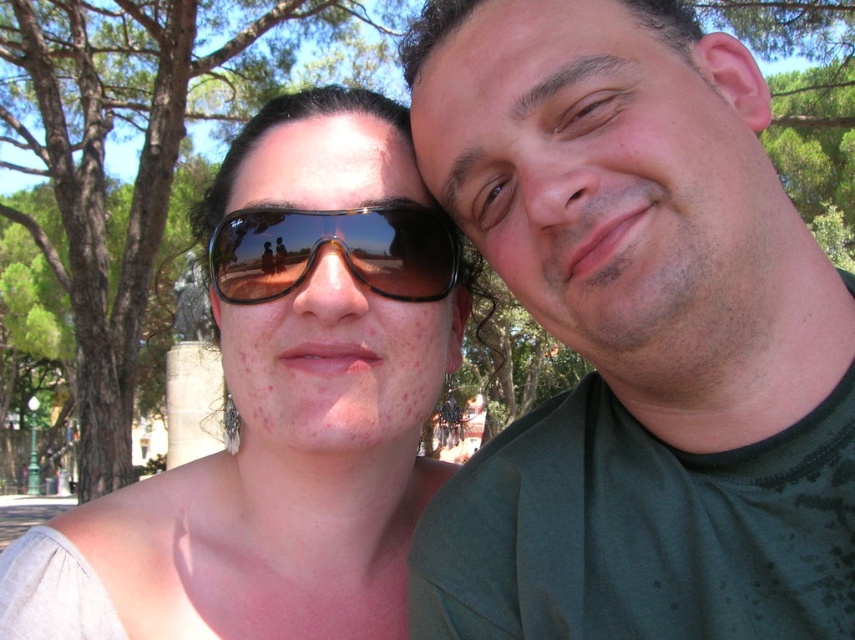
Which is more to the left, matte black sunglasses at upper left or shiny black goggles at center?

From the viewer's perspective, matte black sunglasses at upper left appears more on the left side.

Is point (264, 362) less distant than point (240, 280)?

Yes, it is in front of point (240, 280).

Identify the location of matte black sunglasses at upper left. This screenshot has width=855, height=640. (282, 404).

Does green matte shirt at right have a smaller size compared to shiny black goggles at center?

No, green matte shirt at right is not smaller than shiny black goggles at center.

Who is shorter, green matte shirt at right or shiny black goggles at center?

Standing shorter between the two is shiny black goggles at center.

Between point (640, 545) and point (428, 241), which one is positioned behind?

The point (428, 241) is behind.

In order to click on green matte shirt at right in this screenshot , I will do `click(635, 337)`.

Measure the distance between point (838, 573) and camera.

They are 1.16 meters apart.

Is green matte shirt at right shorter than matte black sunglasses at upper left?

Incorrect, green matte shirt at right's height does not fall short of matte black sunglasses at upper left's.

Locate an element on the screen. green matte shirt at right is located at coordinates (635, 337).